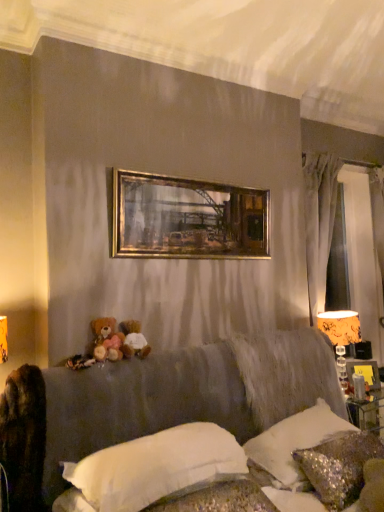
Question: Do you think brown plush toy at lower left, the 2th toy positioned from the left, is within gold metallic picture frame at upper center, or outside of it?

Choices:
 (A) outside
 (B) inside

Answer: (A)

Question: In the image, is brown plush toy at lower left, placed as the first toy when sorted from right to left, positioned in front of or behind gold metallic picture frame at upper center?

Choices:
 (A) front
 (B) behind

Answer: (A)

Question: Which is nearer to the orange fabric lampshade at right?

Choices:
 (A) sparkly silver pillow at lower right, the 1th pillow from the right
 (B) fluffy brown teddy bear at lower center, which is the first toy from left to right
 (C) brown plush toy at lower left, placed as the first toy when sorted from right to left
 (D) gold metallic picture frame at upper center
 (E) satin sequined pillow at lower right, which is the 2th pillow in right-to-left order

Answer: (E)

Question: Which object is positioned closest to the fluffy brown teddy bear at lower center, which is the first toy from left to right?

Choices:
 (A) brown plush toy at lower left, placed as the first toy when sorted from right to left
 (B) gold metallic picture frame at upper center
 (C) orange fabric lampshade at right
 (D) satin sequined pillow at lower right, arranged as the second pillow when viewed from the left
 (E) white soft pillow at center, which ranks as the first pillow in left-to-right order

Answer: (A)